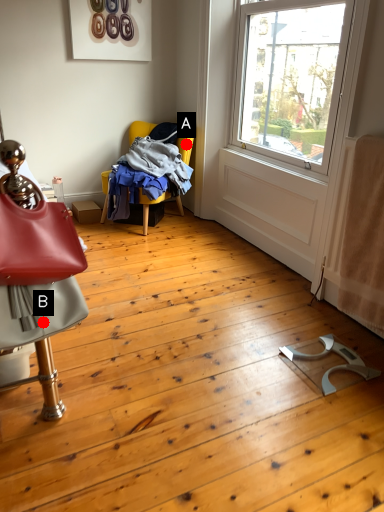
Question: Two points are circled on the image, labeled by A and B beside each circle. Which of the following is the closest to the observer?

Choices:
 (A) A is closer
 (B) B is closer

Answer: (B)